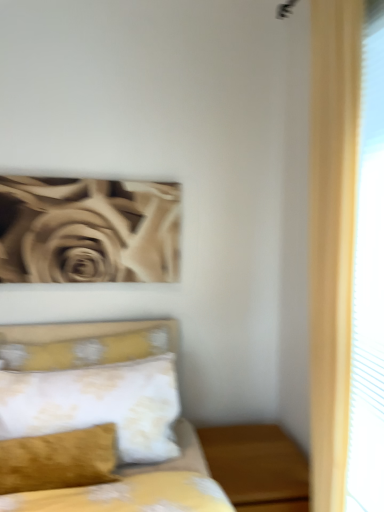
What do you see at coordinates (257, 467) in the screenshot?
I see `wooden nightstand at lower right` at bounding box center [257, 467].

In order to click on yellow floral fabric bed at lower left in this screenshot , I will do `click(95, 421)`.

The image size is (384, 512). What are the coordinates of `wooden nightstand at lower right` in the screenshot? It's located at click(x=257, y=467).

Measure the distance between floral-patterned fabric pillow at center-left and yellow floral fabric bed at lower left.

7.07 centimeters.

From the image's perspective, which is below, floral-patterned fabric pillow at center-left or yellow floral fabric bed at lower left?

From the image's view, yellow floral fabric bed at lower left is below.

Could you tell me if floral-patterned fabric pillow at center-left is facing yellow floral fabric bed at lower left?

Yes.

Is floral-patterned fabric pillow at center-left far away from yellow floral fabric bed at lower left?

They are positioned close to each other.

Which is correct: wooden nightstand at lower right is inside yellow floral fabric bed at lower left, or outside of it?

wooden nightstand at lower right is located beyond the bounds of yellow floral fabric bed at lower left.

Considering the relative positions of wooden nightstand at lower right and yellow floral fabric bed at lower left in the image provided, is wooden nightstand at lower right behind yellow floral fabric bed at lower left?

Yes, it is.

Which of these two, wooden nightstand at lower right or yellow floral fabric bed at lower left, is smaller?

wooden nightstand at lower right is smaller.

From a real-world perspective, relative to beige textured rose at upper left, is wooden nightstand at lower right vertically above or below?

wooden nightstand at lower right is below beige textured rose at upper left.

Which is in front, point (287, 470) or point (30, 184)?

Positioned in front is point (287, 470).

Is wooden nightstand at lower right facing away from beige textured rose at upper left?

No, wooden nightstand at lower right is not facing away from beige textured rose at upper left.

Can you tell me how much wooden nightstand at lower right and beige textured rose at upper left differ in facing direction?

They differ by 0.00082 degrees in their facing directions.

Does point (50, 185) come in front of point (250, 426)?

Yes, point (50, 185) is closer to viewer.

Are beige textured rose at upper left and wooden nightstand at lower right far apart?

No.

Consider the image. In the image, is beige textured rose at upper left positioned in front of or behind wooden nightstand at lower right?

Clearly, beige textured rose at upper left is behind wooden nightstand at lower right.

I want to click on rose that appears on the left of wooden nightstand at lower right, so click(x=88, y=230).

Is beige textured rose at upper left taller or shorter than floral-patterned fabric pillow at center-left?

beige textured rose at upper left is taller than floral-patterned fabric pillow at center-left.

Looking at this image, does beige textured rose at upper left touch floral-patterned fabric pillow at center-left?

No, beige textured rose at upper left is not beside floral-patterned fabric pillow at center-left.

Does point (10, 230) lie behind point (148, 421)?

Yes, it is behind point (148, 421).

Is beige textured rose at upper left inside or outside of floral-patterned fabric pillow at center-left?

beige textured rose at upper left is not inside floral-patterned fabric pillow at center-left, it's outside.

Between point (259, 498) and point (156, 362), which one is positioned behind?

Positioned behind is point (156, 362).

Is wooden nightstand at lower right oriented away from floral-patterned fabric pillow at center-left?

No, wooden nightstand at lower right is not facing the opposite direction of floral-patterned fabric pillow at center-left.

Image resolution: width=384 pixels, height=512 pixels. Identify the location of nightstand below the floral-patterned fabric pillow at center-left (from a real-world perspective). (257, 467).

Considering the sizes of beige textured rose at upper left and yellow floral fabric bed at lower left in the image, is beige textured rose at upper left taller or shorter than yellow floral fabric bed at lower left?

In the image, beige textured rose at upper left appears to be shorter than yellow floral fabric bed at lower left.

Would you say beige textured rose at upper left is a long distance from yellow floral fabric bed at lower left?

No, beige textured rose at upper left is not far from yellow floral fabric bed at lower left.

Measure the distance from beige textured rose at upper left to yellow floral fabric bed at lower left.

beige textured rose at upper left and yellow floral fabric bed at lower left are 20.00 inches apart from each other.

From the image's perspective, would you say beige textured rose at upper left is shown under yellow floral fabric bed at lower left?

Incorrect, from the image's perspective, beige textured rose at upper left is higher than yellow floral fabric bed at lower left.

I want to click on bed in front of the floral-patterned fabric pillow at center-left, so click(95, 421).

I want to click on nightstand that appears on the right of yellow floral fabric bed at lower left, so click(x=257, y=467).

Looking at the image, which one is located further to wooden nightstand at lower right, floral-patterned fabric pillow at center-left or yellow floral fabric bed at lower left?

Among the two, yellow floral fabric bed at lower left is located further to wooden nightstand at lower right.

From the image, which object appears to be nearer to yellow floral fabric bed at lower left, floral-patterned fabric pillow at center-left or beige textured rose at upper left?

The object closer to yellow floral fabric bed at lower left is floral-patterned fabric pillow at center-left.

Based on their spatial positions, is beige textured rose at upper left or floral-patterned fabric pillow at center-left further from yellow floral fabric bed at lower left?

beige textured rose at upper left lies further to yellow floral fabric bed at lower left than the other object.

When comparing their distances from beige textured rose at upper left, does wooden nightstand at lower right or yellow floral fabric bed at lower left seem further?

Among the two, wooden nightstand at lower right is located further to beige textured rose at upper left.

From the image, which object appears to be nearer to floral-patterned fabric pillow at center-left, yellow floral fabric bed at lower left or wooden nightstand at lower right?

yellow floral fabric bed at lower left is closer to floral-patterned fabric pillow at center-left.

From the image, which object appears to be farther from floral-patterned fabric pillow at center-left, beige textured rose at upper left or yellow floral fabric bed at lower left?

beige textured rose at upper left is positioned further to the anchor floral-patterned fabric pillow at center-left.

From the image, which object appears to be farther from beige textured rose at upper left, yellow floral fabric bed at lower left or wooden nightstand at lower right?

wooden nightstand at lower right is further to beige textured rose at upper left.

Based on their spatial positions, is yellow floral fabric bed at lower left or floral-patterned fabric pillow at center-left closer to beige textured rose at upper left?

yellow floral fabric bed at lower left lies closer to beige textured rose at upper left than the other object.

In order to click on pillow that lies between beige textured rose at upper left and wooden nightstand at lower right from top to bottom in this screenshot , I will do `click(98, 405)`.

Where is `pillow between beige textured rose at upper left and yellow floral fabric bed at lower left from top to bottom`? pillow between beige textured rose at upper left and yellow floral fabric bed at lower left from top to bottom is located at coordinates (98, 405).

What are the coordinates of `bed located between floral-patterned fabric pillow at center-left and wooden nightstand at lower right in the left-right direction` in the screenshot? It's located at (95, 421).

I want to click on bed that lies between beige textured rose at upper left and wooden nightstand at lower right from top to bottom, so click(x=95, y=421).